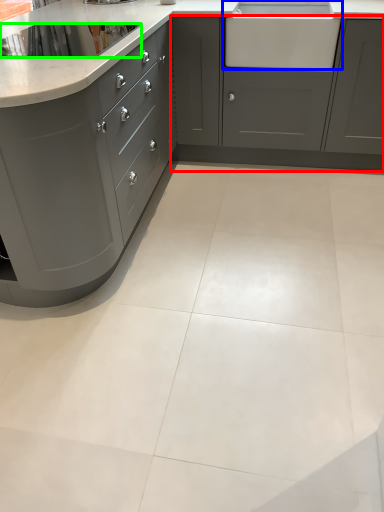
Question: Considering the real-world distances, which object is closest to cabinetry (highlighted by a red box)? sink (highlighted by a blue box) or appliance (highlighted by a green box).

Choices:
 (A) sink
 (B) appliance

Answer: (A)